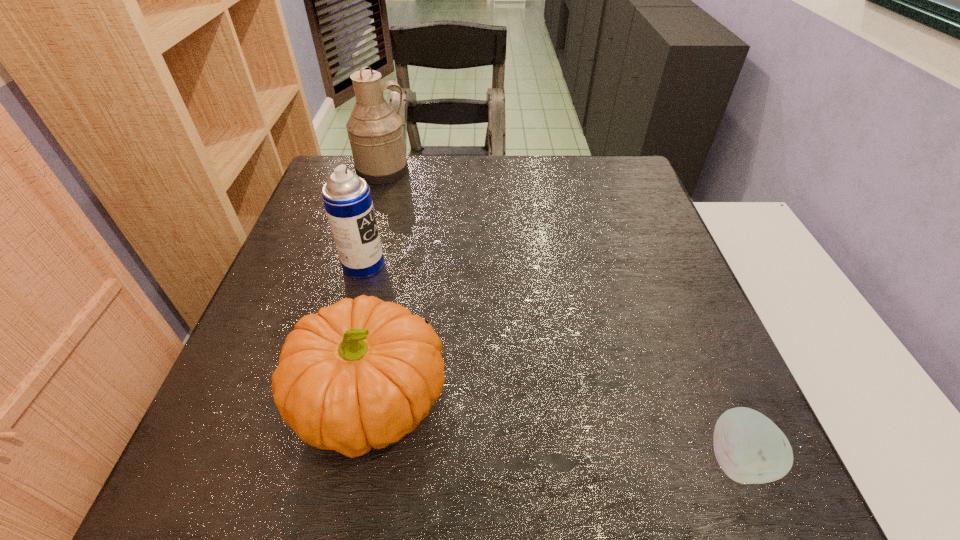
Locate which object ranks in proximity to the pumpkin. Please provide its 2D coordinates. Your answer should be formatted as a tuple, i.e. [(x, y)], where the tuple contains the x and y coordinates of a point satisfying the conditions above.

[(347, 199)]

Find the location of `vacant space that satisfies the following two spatial constraints: 1. on the surface of the pumpkin; 2. on the back side of the shortest object`. vacant space that satisfies the following two spatial constraints: 1. on the surface of the pumpkin; 2. on the back side of the shortest object is located at coordinates (365, 460).

What are the coordinates of `vacant area that satisfies the following two spatial constraints: 1. on the label side of the second farthest object; 2. on the back side of the apple` in the screenshot? It's located at (311, 460).